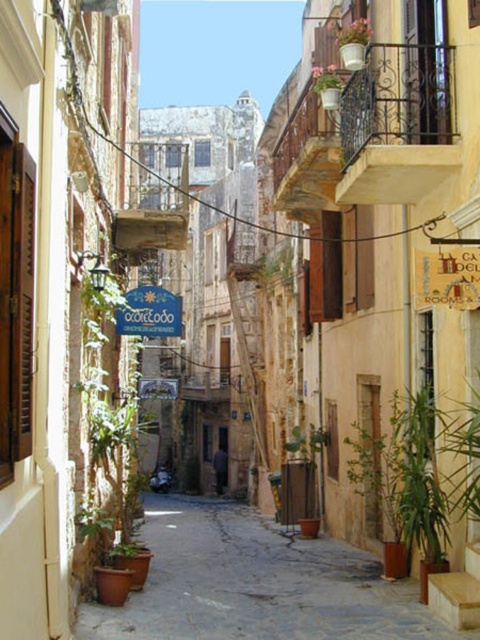
Between green leafy plant at left and blue painted wood sign at center, which one appears on the left side from the viewer's perspective?

green leafy plant at left

Which is in front, point (115, 349) or point (166, 320)?

Positioned in front is point (166, 320).

This screenshot has height=640, width=480. Describe the element at coordinates (108, 417) in the screenshot. I see `green leafy plant at left` at that location.

This screenshot has height=640, width=480. I want to click on green leafy plant at left, so click(108, 417).

Does wooden signboard at center have a lesser width compared to blue painted wood sign at center?

Indeed, wooden signboard at center has a lesser width compared to blue painted wood sign at center.

Does point (455, 244) lie in front of point (135, 312)?

That is True.

The width and height of the screenshot is (480, 640). Find the location of `wooden signboard at center`. wooden signboard at center is located at coordinates (446, 276).

Is green leafy plant at lower right in front of blue painted wood sign at center?

Yes, green leafy plant at lower right is in front of blue painted wood sign at center.

Can you confirm if green leafy plant at lower right is taller than blue painted wood sign at center?

Yes.

Find the location of a particular element. green leafy plant at lower right is located at coordinates (462, 456).